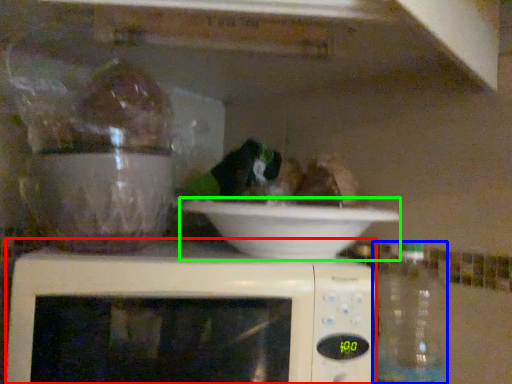
Question: Considering the real-world distances, which object is closest to microwave oven (highlighted by a red box)? bottle (highlighted by a blue box) or bowl (highlighted by a green box).

Choices:
 (A) bottle
 (B) bowl

Answer: (B)